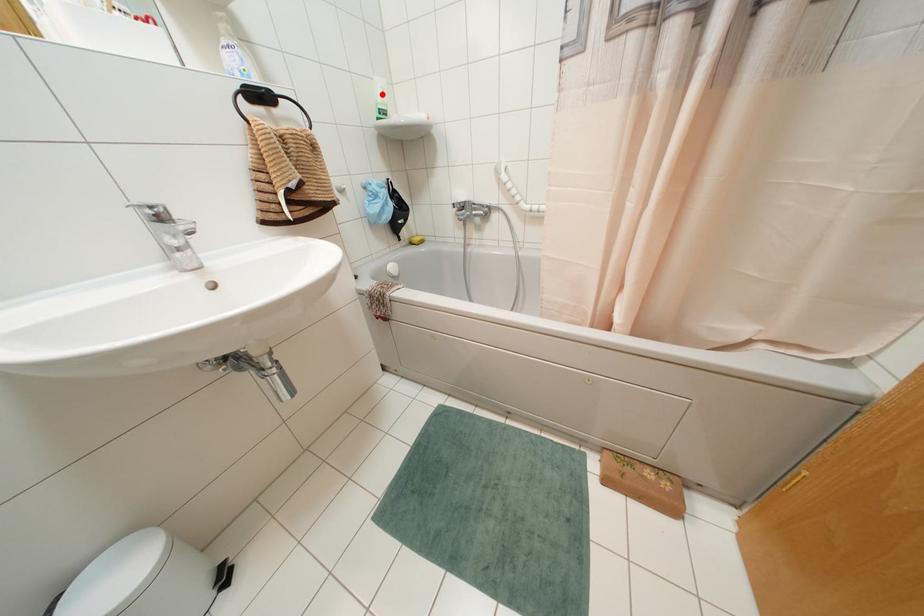
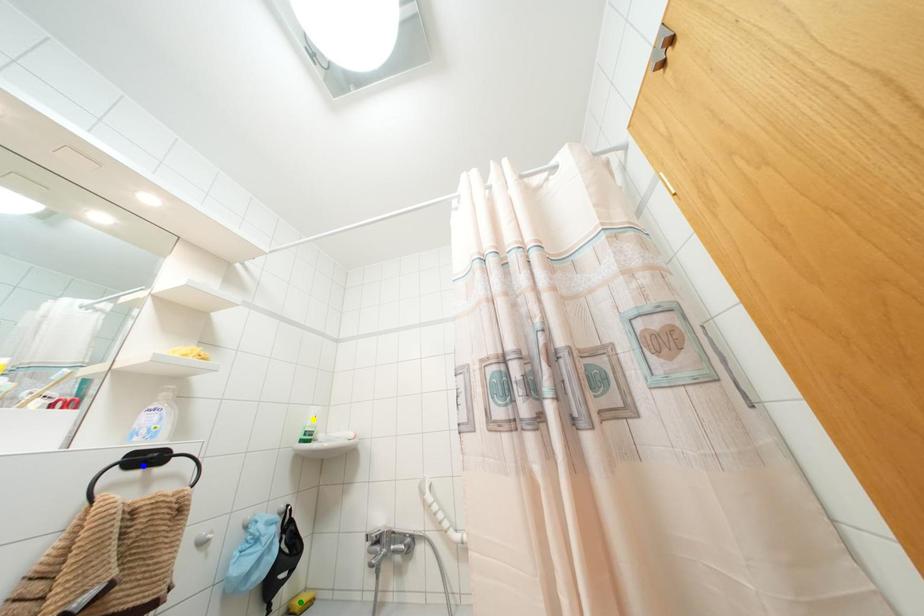
Question: I am providing you with two images of the same scene from different viewpoints. A red point is marked on the first image. You are given multiple points on the second image. Which mark in image 2 goes with the point in image 1?

Choices:
 (A) yellow point
 (B) green point
 (C) blue point

Answer: (A)